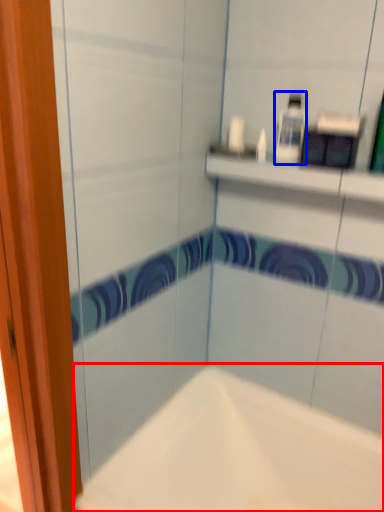
Question: Which point is closer to the camera, bathtub (highlighted by a red box) or toiletry (highlighted by a blue box)?

Choices:
 (A) bathtub
 (B) toiletry

Answer: (A)